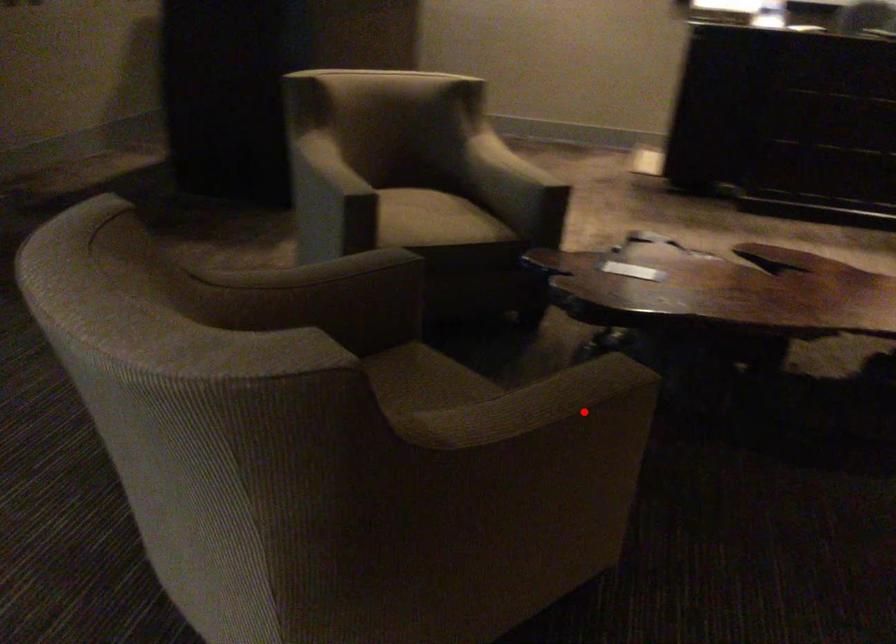
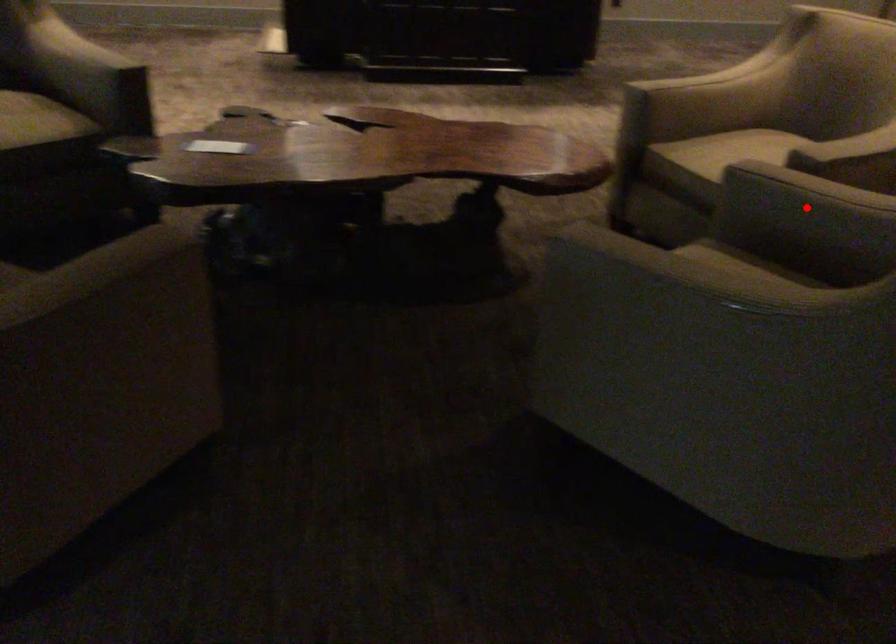
I am providing you with two images of the same scene from different viewpoints. A red point is marked on the first image and another point is marked on the second image. Are the points marked in image1 and image2 representing the same 3D position?

No